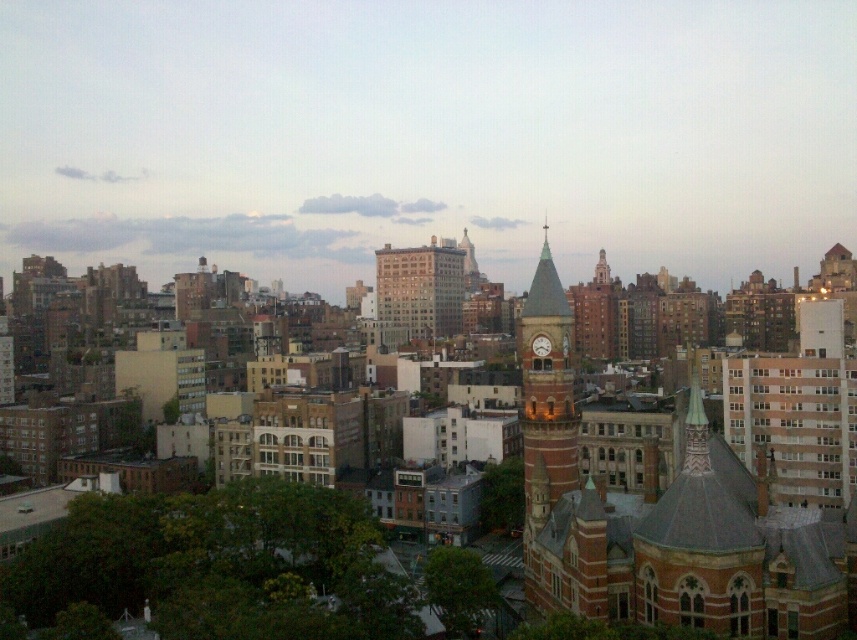
Is green copper dome at center above brick clock tower at center?

Incorrect, green copper dome at center is not positioned above brick clock tower at center.

Who is higher up, green copper dome at center or brick clock tower at center?

brick clock tower at center

Between point (721, 444) and point (524, 387), which one is positioned behind?

The point (524, 387) is more distant.

This screenshot has width=857, height=640. Identify the location of green copper dome at center. (700, 541).

Does green copper dome at center have a lesser height compared to matte brick clock tower at center?

Incorrect, green copper dome at center's height does not fall short of matte brick clock tower at center's.

Does green copper dome at center appear on the right side of matte brick clock tower at center?

Yes, green copper dome at center is to the right of matte brick clock tower at center.

Which is behind, point (754, 618) or point (537, 342)?

The point (537, 342) is behind.

Identify the location of green copper dome at center. Image resolution: width=857 pixels, height=640 pixels. (700, 541).

Can you confirm if brick clock tower at center is bigger than matte brick clock tower at center?

Yes, brick clock tower at center is bigger than matte brick clock tower at center.

What do you see at coordinates (546, 397) in the screenshot? I see `brick clock tower at center` at bounding box center [546, 397].

I want to click on brick clock tower at center, so click(x=546, y=397).